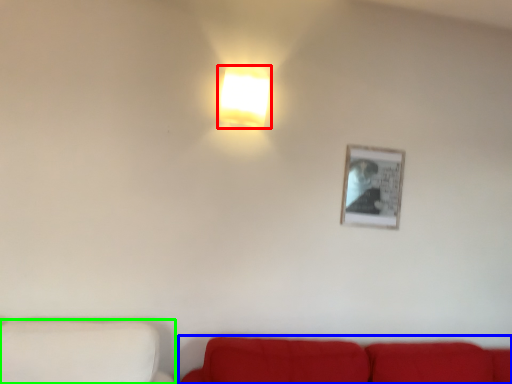
Question: Which object is positioned farthest from lamp (highlighted by a red box)? Select from studio couch (highlighted by a blue box) and furniture (highlighted by a green box).

Choices:
 (A) studio couch
 (B) furniture

Answer: (A)